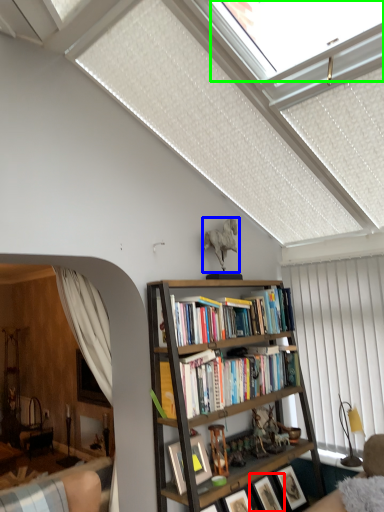
Question: Which is farther away from picture frame (highlighted by a red box)? toy (highlighted by a blue box) or window (highlighted by a green box)?

Choices:
 (A) toy
 (B) window

Answer: (B)